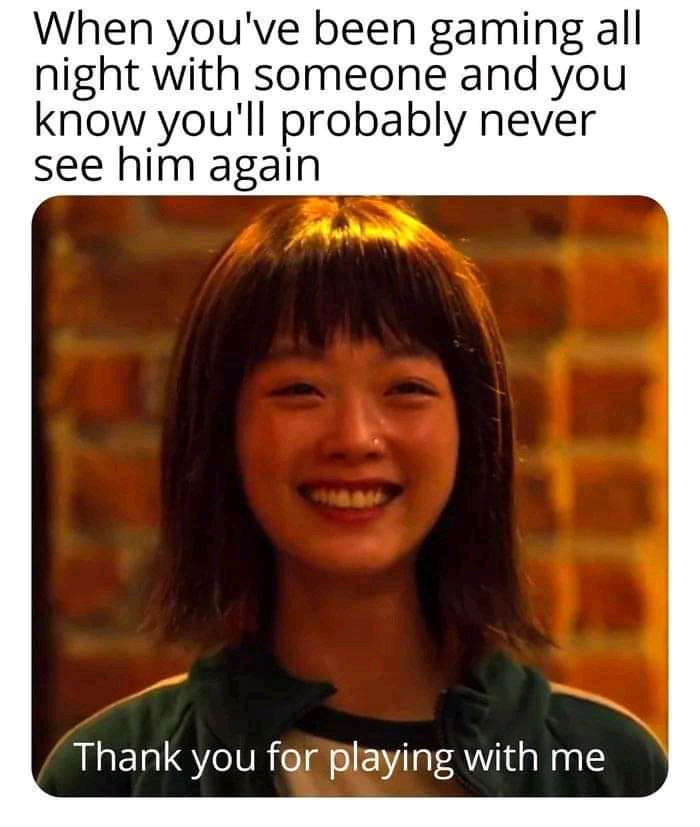
You are a GUI agent. You are given a task and a screenshot of the screen. Output one action in this format:
    pyautogui.click(x=<x>, y=<y>)
    Task: Click on the brick wall
    
    Given the screenshot: What is the action you would take?
    pyautogui.click(x=116, y=389)